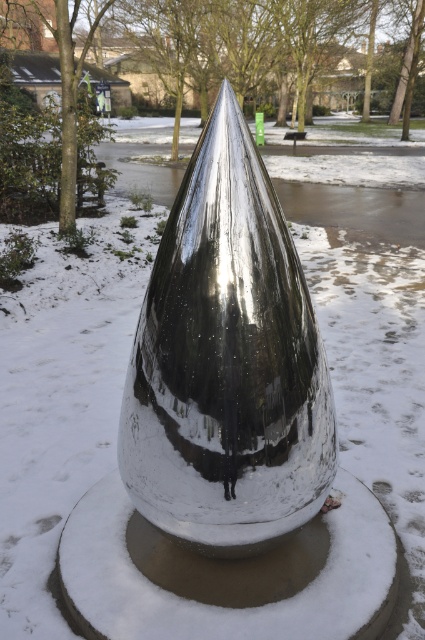
Who is more forward, (x=306, y=435) or (x=85, y=64)?

Point (x=306, y=435)

Does shiny metallic cone at center appear over green matte tree at center?

No, shiny metallic cone at center is not above green matte tree at center.

Identify the location of shiny metallic cone at center. The image size is (425, 640). (226, 360).

Identify the location of shiny metallic cone at center. (226, 360).

Between green matte tree at center and brown wood tree at left, which one appears on the right side from the viewer's perspective?

Positioned to the right is green matte tree at center.

This screenshot has height=640, width=425. What do you see at coordinates (61, 72) in the screenshot?
I see `green matte tree at center` at bounding box center [61, 72].

The width and height of the screenshot is (425, 640). Describe the element at coordinates (61, 72) in the screenshot. I see `green matte tree at center` at that location.

At what (x,y) coordinates should I click in order to perform the action: click on green matte tree at center. Please return your answer as a coordinate pair (x, y). Looking at the image, I should click on (61, 72).

Which is above, shiny metallic cone at center or brown wood tree at left?

brown wood tree at left is higher up.

Can you confirm if shiny metallic cone at center is positioned to the left of brown wood tree at left?

Incorrect, shiny metallic cone at center is not on the left side of brown wood tree at left.

Which is in front, point (147, 454) or point (56, 163)?

Point (147, 454) is more forward.

You are a GUI agent. You are given a task and a screenshot of the screen. Output one action in this format:
    pyautogui.click(x=<x>, y=<y>)
    Task: Click on the shiny metallic cone at center
    Image resolution: width=425 pixels, height=640 pixels.
    Given the screenshot: What is the action you would take?
    pyautogui.click(x=226, y=360)